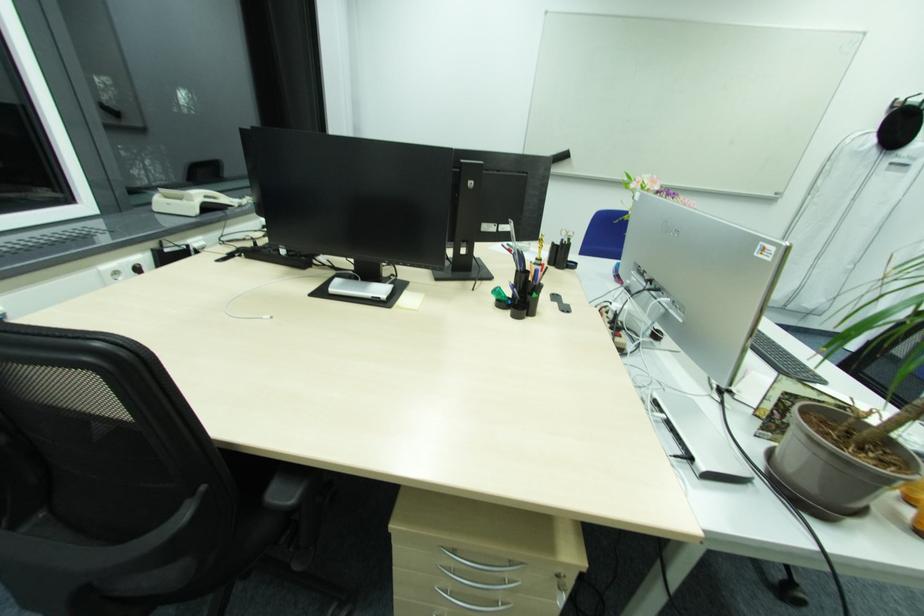
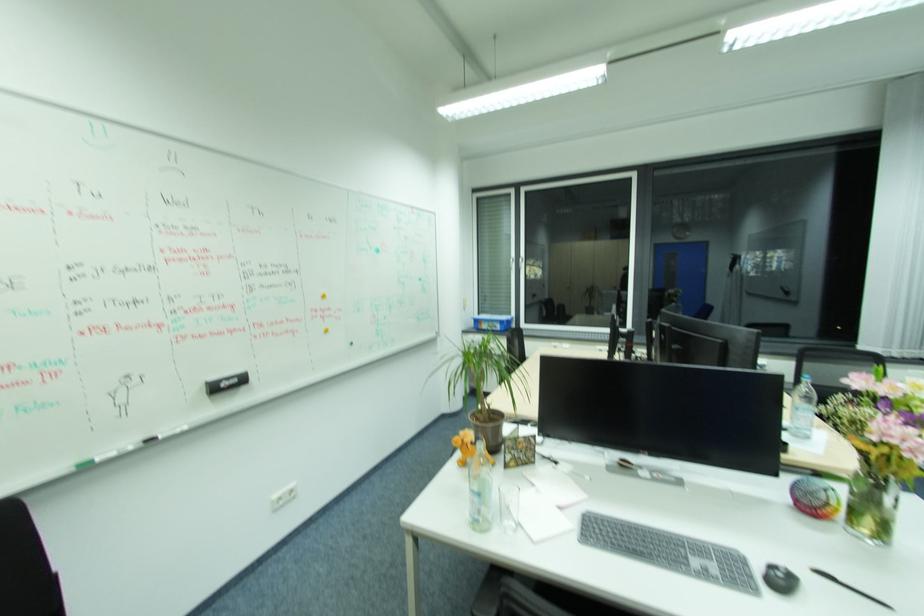
The point at [477,184] is marked in the first image. Where is the corresponding point in the second image?

(666, 334)